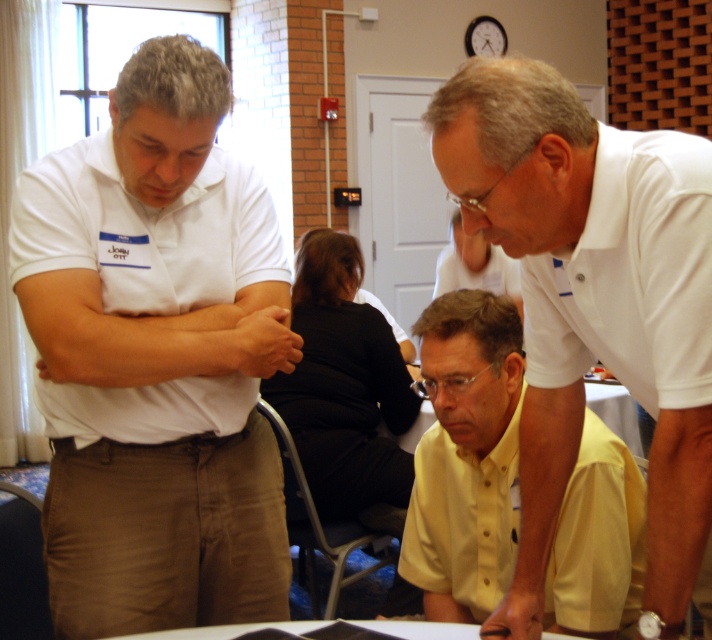
You are a photographer adjusting your camera settings to focus on two specific points in the image. The points are labeled as point (68, 326) and point (461, 237). Which point should you focus on first if you want to ensure both are in sharp focus, starting with the one closer to the camera?

You should focus on point (68, 326) first since it is closer to the camera than point (461, 237), allowing you to adjust the focus from near to far for both points.